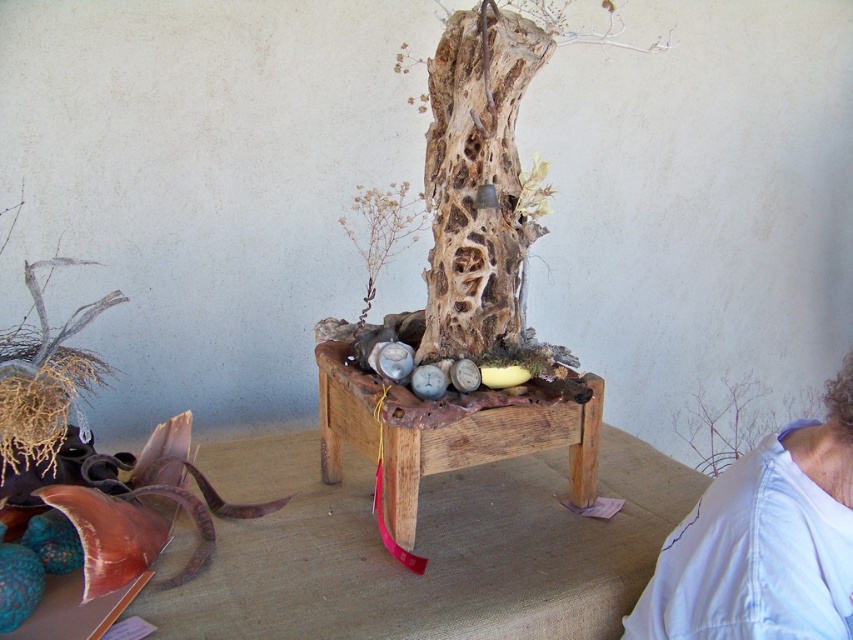
You are observing the rustic arrangement on the wooden table. There are two points marked on the image. Which point, point (811,630) or point (544,401), is closer to you?

Point (811,630) is closer to the camera than point (544,401).

You are standing in front of the rustic arrangement on the wooden table. You see two points marked on the image, point 1 at coordinates point (x=444, y=321) and point 2 at coordinates point (x=517, y=428). Which point is closer to you?

Point (x=444, y=321) is closer to you because it is further to the viewer than point (x=517, y=428).

You are an interior designer arranging items on a table. You have a light blue fabric at upper right and a natural wood tree trunk at center. Which item is placed closer to the edge of the table?

The light blue fabric at upper right is positioned under the natural wood tree trunk at center, so it is closer to the edge of the table.